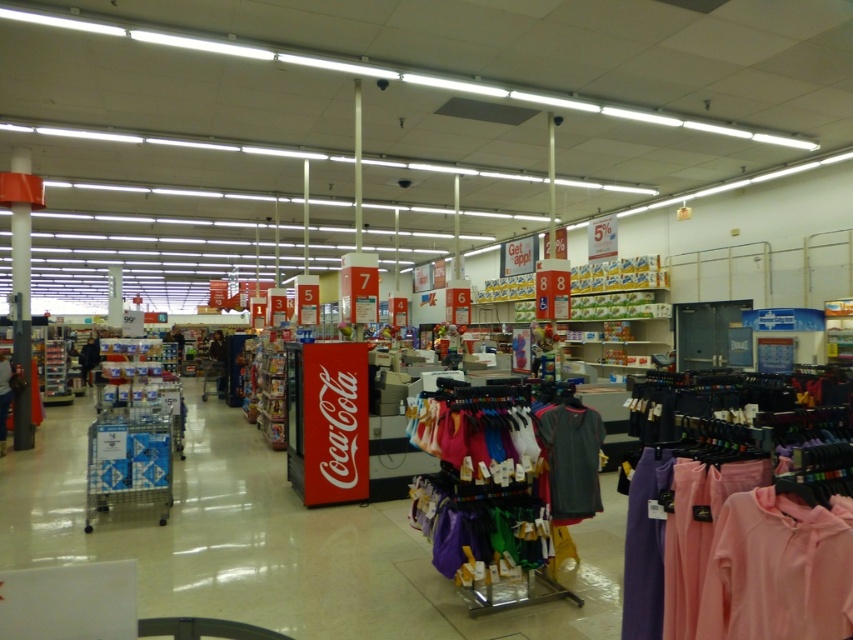
Is the position of matte black hoodie at center more distant than that of matte black jacket at center?

No, it is not.

Identify the location of matte black hoodie at center. (4, 397).

Is point (10, 397) more distant than point (93, 346)?

No.

This screenshot has height=640, width=853. Identify the location of matte black hoodie at center. (4, 397).

Who is higher up, dark gray jersey at center or matte black hoodie at center?

dark gray jersey at center is higher up.

Describe the element at coordinates (572, 458) in the screenshot. I see `dark gray jersey at center` at that location.

Where is `dark gray jersey at center`? This screenshot has width=853, height=640. dark gray jersey at center is located at coordinates (572, 458).

Which is more to the right, pink fabric hoodie at lower right or matte black hoodie at center?

Positioned to the right is pink fabric hoodie at lower right.

Does pink fabric hoodie at lower right have a greater width compared to matte black hoodie at center?

No.

The height and width of the screenshot is (640, 853). I want to click on pink fabric hoodie at lower right, so click(x=778, y=570).

Where is `pink fabric hoodie at lower right`? The width and height of the screenshot is (853, 640). pink fabric hoodie at lower right is located at coordinates (778, 570).